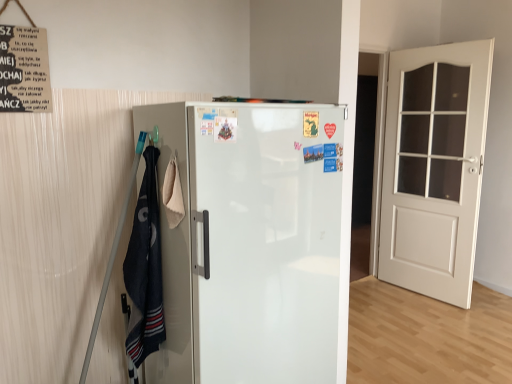
Locate an element on the screen. The width and height of the screenshot is (512, 384). vacant space situated on the left part of white wood door at right is located at coordinates (381, 299).